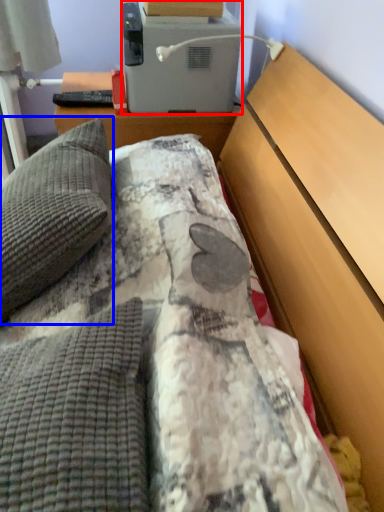
Question: Which object is closer to the camera taking this photo, appliance (highlighted by a red box) or pillow (highlighted by a blue box)?

Choices:
 (A) appliance
 (B) pillow

Answer: (B)